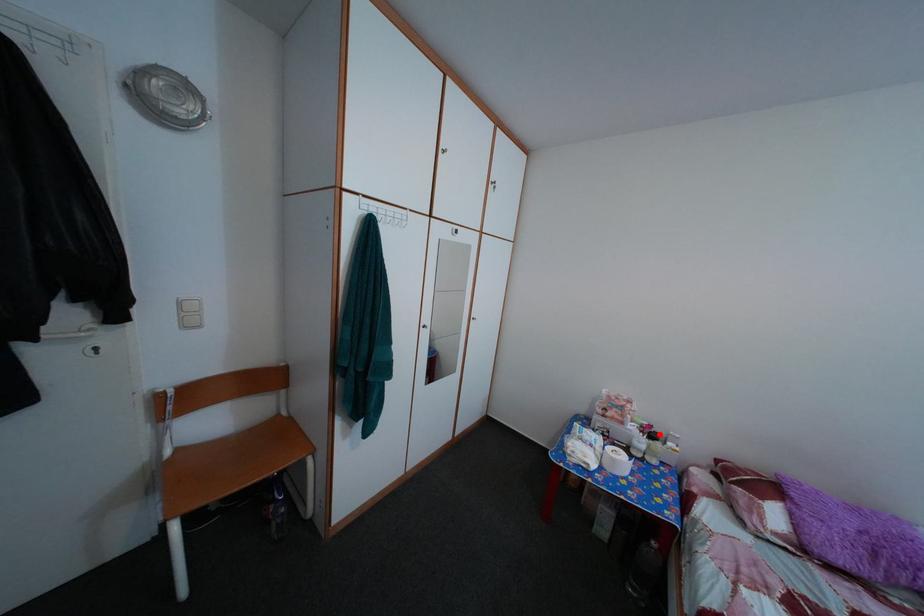
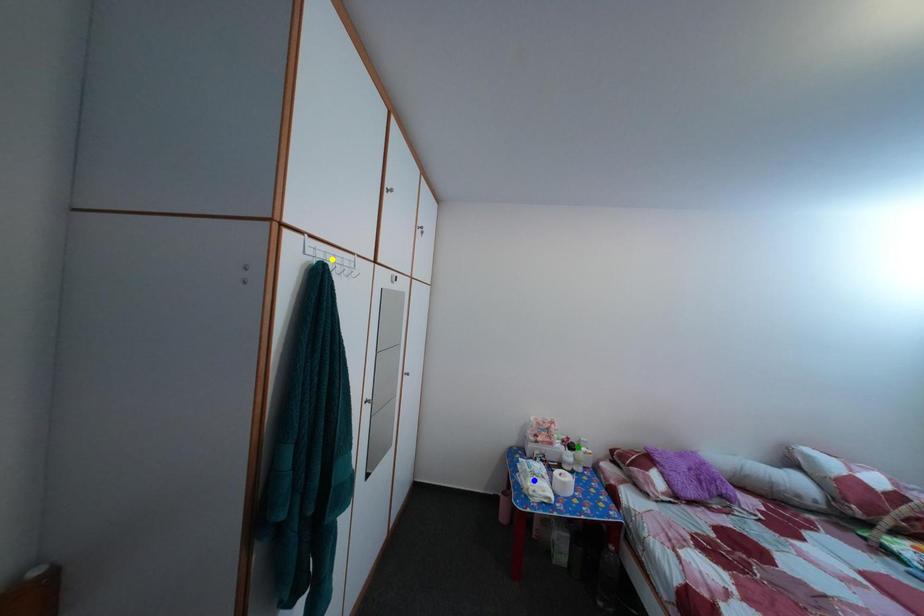
Question: I am providing you with two images of the same scene from different viewpoints. A red point is marked on the first image. You are given multiple points on the second image. Which point in image 2 represents the same 3d spot as the red point in image 1?

Choices:
 (A) blue point
 (B) yellow point
 (C) green point

Answer: (C)